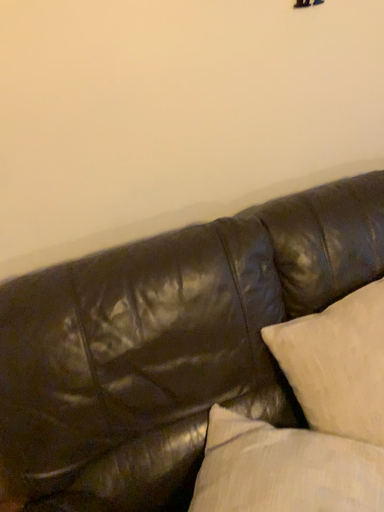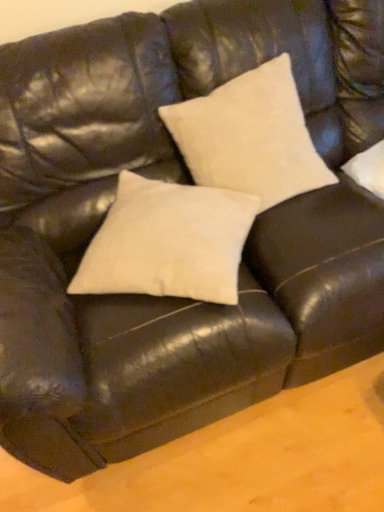
Question: How did the camera likely rotate when shooting the video?

Choices:
 (A) rotated downward
 (B) rotated upward

Answer: (A)